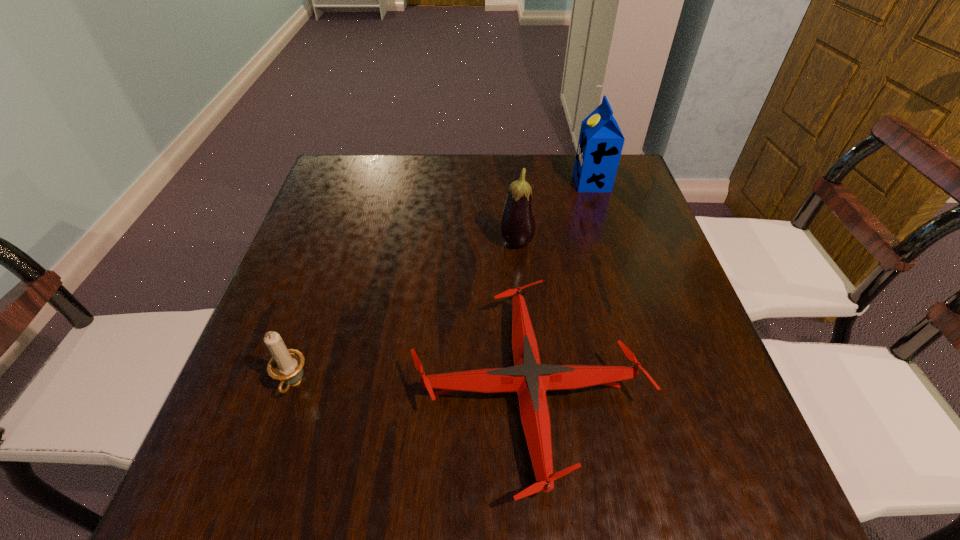
The width and height of the screenshot is (960, 540). Find the location of `free location that satisfies the following two spatial constraints: 1. with the cap open on the farthest object; 2. on the front side of the eggplant`. free location that satisfies the following two spatial constraints: 1. with the cap open on the farthest object; 2. on the front side of the eggplant is located at coordinates (611, 244).

I want to click on free space in the image that satisfies the following two spatial constraints: 1. with the cap open on the carton; 2. on the front side of the third nearest object, so click(x=611, y=244).

Image resolution: width=960 pixels, height=540 pixels. In order to click on vacant region that satisfies the following two spatial constraints: 1. with the cap open on the carton; 2. on the handle side of the candle_holder in this screenshot , I will do `click(654, 385)`.